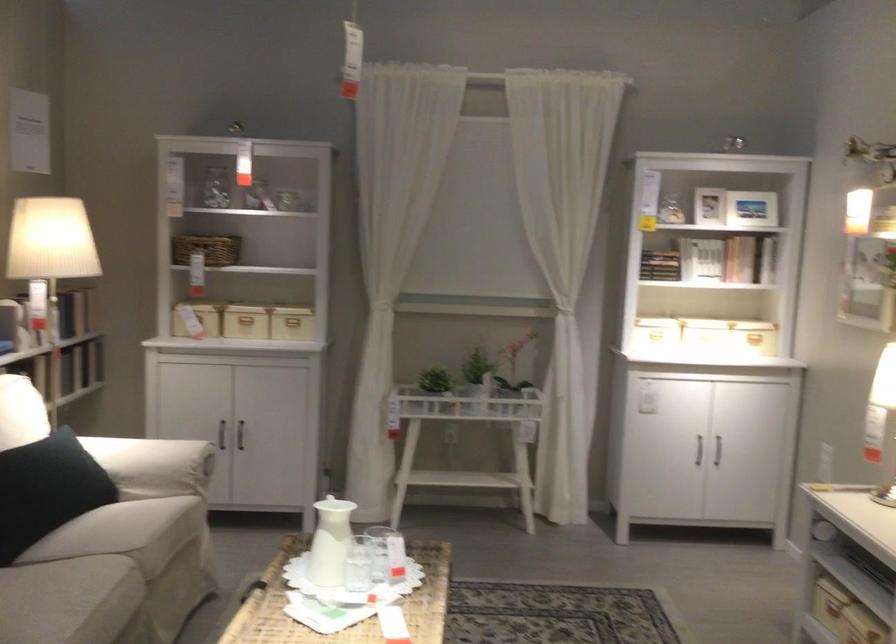
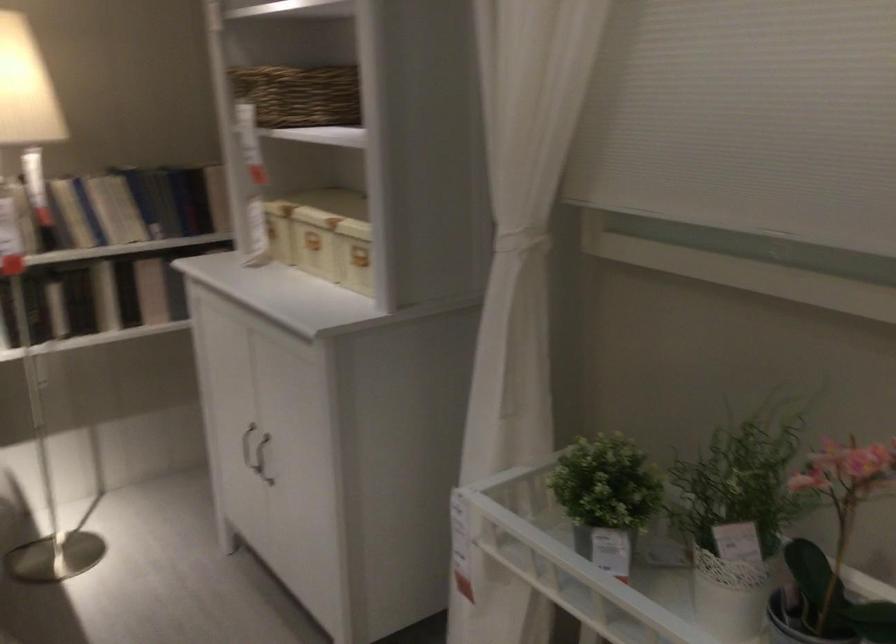
Locate, in the second image, the point that corresponds to (513,384) in the first image.

(839, 542)